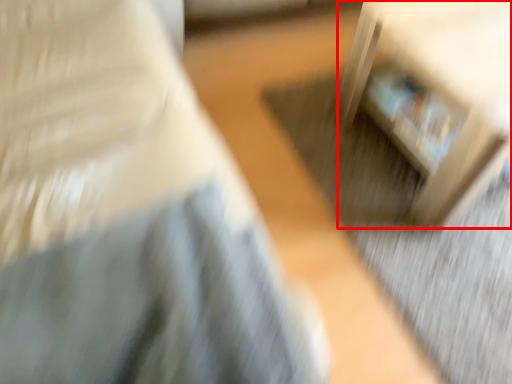
Question: From the image's perspective, considering the relative positions of furniture (annotated by the red box) and furniture in the image provided, where is furniture (annotated by the red box) located with respect to the staircase?

Choices:
 (A) above
 (B) below

Answer: (B)